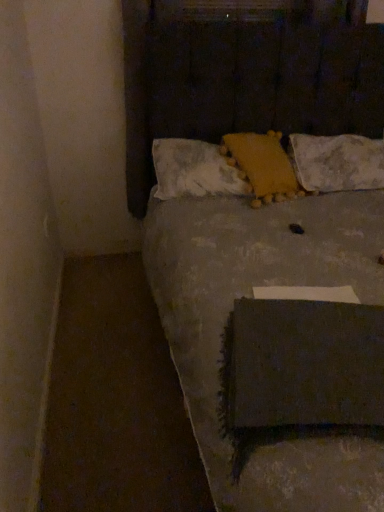
Question: Looking at their shapes, would you say white textured pillow at upper center, placed as the 3th pillow when sorted from left to right, is wider or thinner than yellow fuzzy pillow at center, which is the second pillow in right-to-left order?

Choices:
 (A) wide
 (B) thin

Answer: (A)

Question: Is white textured pillow at upper center, placed as the 3th pillow when sorted from left to right, taller or shorter than yellow fuzzy pillow at center, which is counted as the 2th pillow, starting from the left?

Choices:
 (A) tall
 (B) short

Answer: (B)

Question: Which object is the closest to the textured gray bed at center?

Choices:
 (A) yellow textured pillow at center, the third pillow when ordered from right to left
 (B) white textured pillow at upper center, placed as the 3th pillow when sorted from left to right
 (C) yellow fuzzy pillow at center, which is the second pillow in right-to-left order

Answer: (A)

Question: Estimate the real-world distances between objects in this image. Which object is farther from the yellow textured pillow at center, which ranks as the first pillow in left-to-right order?

Choices:
 (A) textured gray bed at center
 (B) yellow fuzzy pillow at center, which is the second pillow in right-to-left order
 (C) white textured pillow at upper center, placed as the 3th pillow when sorted from left to right

Answer: (C)